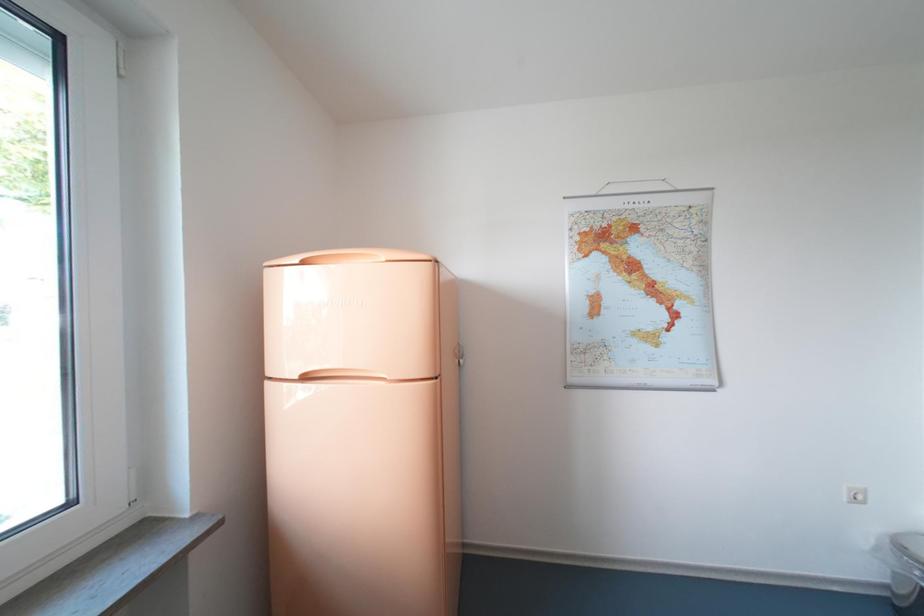
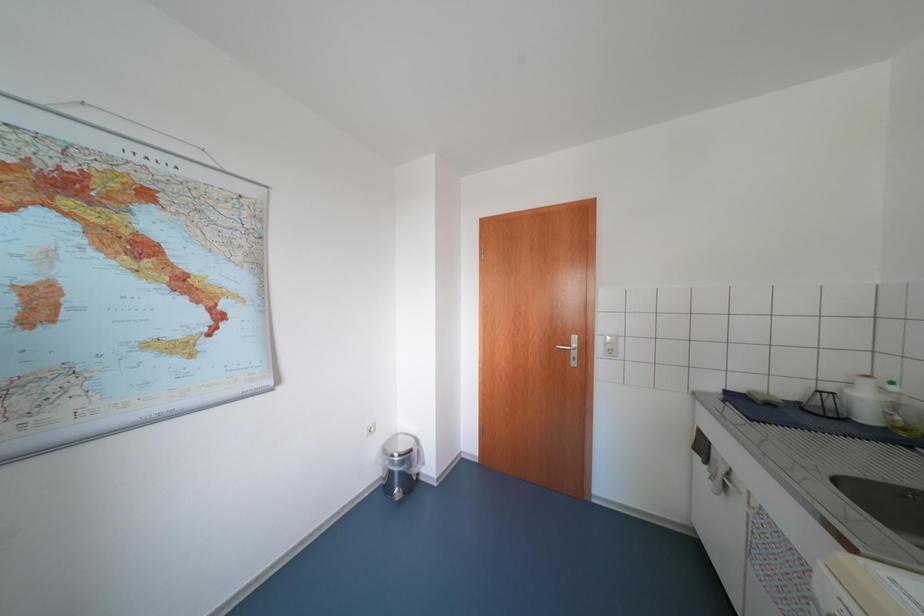
Question: Based on the continuous images, in which direction is the camera rotating? Reply with the corresponding letter.

Choices:
 (A) Left
 (B) Right
 (C) Up
 (D) Down

Answer: (B)